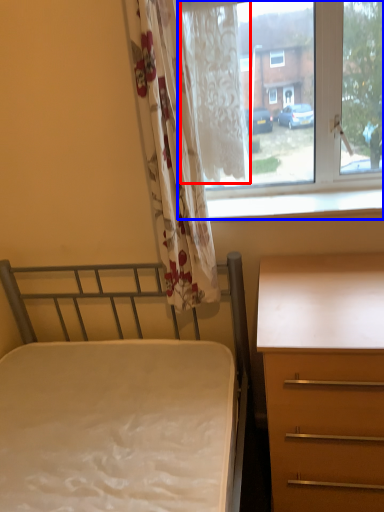
Question: Among these objects, which one is farthest to the camera, curtain (highlighted by a red box) or window (highlighted by a blue box)?

Choices:
 (A) curtain
 (B) window

Answer: (A)